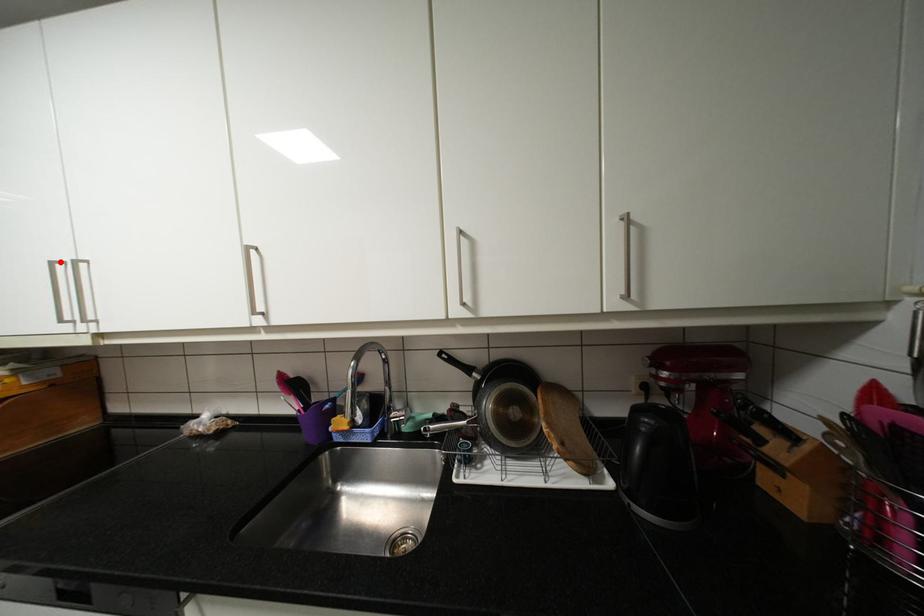
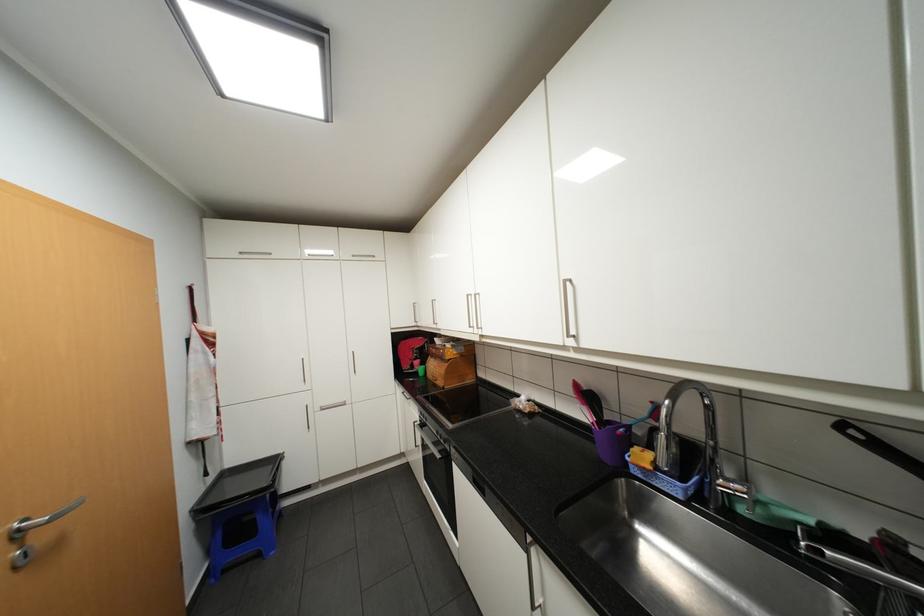
Find the pixel in the second image that matches the highlighted location in the first image.

(476, 294)